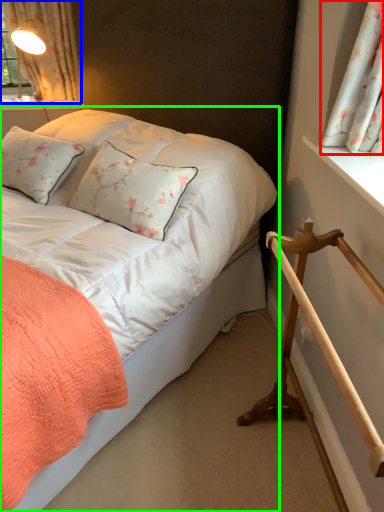
Question: Based on their relative distances, which object is nearer to curtain (highlighted by a red box)? Choose from curtain (highlighted by a blue box) and bed (highlighted by a green box).

Choices:
 (A) curtain
 (B) bed

Answer: (B)